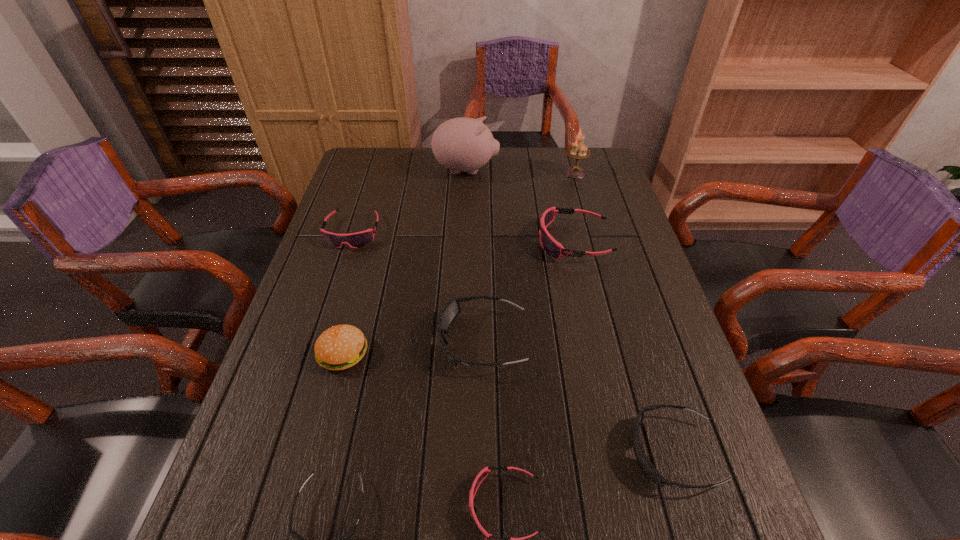
Image resolution: width=960 pixels, height=540 pixels. Find the location of `the second closest black goggles to the candle holder`. the second closest black goggles to the candle holder is located at coordinates (644, 462).

The image size is (960, 540). In order to click on black goggles that is the second closest to the biggest pink goggles in this screenshot , I will do `click(644, 462)`.